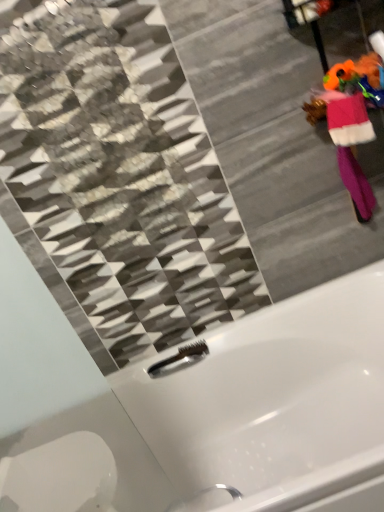
Locate an element on the screen. This screenshot has height=512, width=384. brushed metal faucet at lower center is located at coordinates pos(181,355).

What do you see at coordinates (228, 418) in the screenshot? I see `white glossy bathtub at center` at bounding box center [228, 418].

Identify the location of pink fuzzy robe at right. This screenshot has width=384, height=512. (350, 149).

Is the position of white glossy bathtub at center more distant than that of pink fuzzy robe at right?

No.

Considering the sizes of objects white glossy bathtub at center and pink fuzzy robe at right in the image provided, who is shorter, white glossy bathtub at center or pink fuzzy robe at right?

pink fuzzy robe at right is shorter.

From a real-world perspective, does white glossy bathtub at center sit lower than pink fuzzy robe at right?

Yes, from a real-world perspective, white glossy bathtub at center is beneath pink fuzzy robe at right.

Locate an element on the screen. The width and height of the screenshot is (384, 512). bathtub that is in front of the pink fuzzy robe at right is located at coordinates (228, 418).

Can you tell me how much pink fuzzy robe at right and white glossy bathtub at center differ in facing direction?

29.5 degrees separate the facing orientations of pink fuzzy robe at right and white glossy bathtub at center.

From their relative heights in the image, would you say pink fuzzy robe at right is taller or shorter than white glossy bathtub at center?

Clearly, pink fuzzy robe at right is shorter compared to white glossy bathtub at center.

Considering the positions of objects brushed metal faucet at lower center and white glossy bathtub at center in the image provided, who is more to the left, brushed metal faucet at lower center or white glossy bathtub at center?

brushed metal faucet at lower center.

Which object is wider, brushed metal faucet at lower center or white glossy bathtub at center?

white glossy bathtub at center.

You are a GUI agent. You are given a task and a screenshot of the screen. Output one action in this format:
    pyautogui.click(x=<x>, y=<y>)
    Task: Click on the bathtub located in front of the brushed metal faucet at lower center
    
    Given the screenshot: What is the action you would take?
    pyautogui.click(x=228, y=418)

Consider the image. Is brushed metal faucet at lower center looking in the opposite direction of white glossy bathtub at center?

Yes, brushed metal faucet at lower center is positioned with its back facing white glossy bathtub at center.

Is pink fuzzy robe at right turned away from brushed metal faucet at lower center?

No, pink fuzzy robe at right is not facing the opposite direction of brushed metal faucet at lower center.

Which point is more forward, (361, 178) or (154, 366)?

Point (361, 178)

Between pink fuzzy robe at right and brushed metal faucet at lower center, which one has smaller size?

Smaller between the two is brushed metal faucet at lower center.

Is pink fuzzy robe at right taller or shorter than brushed metal faucet at lower center?

Considering their sizes, pink fuzzy robe at right has more height than brushed metal faucet at lower center.

Is brushed metal faucet at lower center next to pink fuzzy robe at right?

There is a gap between brushed metal faucet at lower center and pink fuzzy robe at right.

In the scene shown: Is brushed metal faucet at lower center to the right of pink fuzzy robe at right from the viewer's perspective?

No, brushed metal faucet at lower center is not to the right of pink fuzzy robe at right.

Considering the relative sizes of brushed metal faucet at lower center and pink fuzzy robe at right in the image provided, is brushed metal faucet at lower center shorter than pink fuzzy robe at right?

Indeed, brushed metal faucet at lower center has a lesser height compared to pink fuzzy robe at right.

Considering the positions of point (201, 353) and point (361, 192), is point (201, 353) closer or farther from the camera than point (361, 192)?

Point (201, 353) appears to be farther away from the viewer than point (361, 192).

From the picture: Which of these two, white glossy bathtub at center or brushed metal faucet at lower center, is smaller?

brushed metal faucet at lower center.

I want to click on faucet located above the white glossy bathtub at center (from the image's perspective), so click(181, 355).

Who is shorter, white glossy bathtub at center or brushed metal faucet at lower center?

brushed metal faucet at lower center.

Can we say white glossy bathtub at center lies outside brushed metal faucet at lower center?

Yes, white glossy bathtub at center is not within brushed metal faucet at lower center.

Locate an element on the screen. The width and height of the screenshot is (384, 512). robe located above the white glossy bathtub at center (from the image's perspective) is located at coordinates (350, 149).

You are a GUI agent. You are given a task and a screenshot of the screen. Output one action in this format:
    pyautogui.click(x=<x>, y=<y>)
    Task: Click on the bathtub lying in front of the pink fuzzy robe at right
    The height and width of the screenshot is (512, 384).
    Given the screenshot: What is the action you would take?
    pyautogui.click(x=228, y=418)

Considering their positions, is brushed metal faucet at lower center positioned further to pink fuzzy robe at right than white glossy bathtub at center?

brushed metal faucet at lower center.

Looking at the image, which one is located closer to brushed metal faucet at lower center, white glossy bathtub at center or pink fuzzy robe at right?

white glossy bathtub at center is positioned closer to the anchor brushed metal faucet at lower center.

Considering their positions, is brushed metal faucet at lower center positioned closer to white glossy bathtub at center than pink fuzzy robe at right?

Based on the image, brushed metal faucet at lower center appears to be nearer to white glossy bathtub at center.

Estimate the real-world distances between objects in this image. Which object is closer to pink fuzzy robe at right, white glossy bathtub at center or brushed metal faucet at lower center?

white glossy bathtub at center is positioned closer to the anchor pink fuzzy robe at right.

In the scene shown: When comparing their distances from white glossy bathtub at center, does pink fuzzy robe at right or brushed metal faucet at lower center seem further?

Based on the image, pink fuzzy robe at right appears to be further to white glossy bathtub at center.

Considering their positions, is pink fuzzy robe at right positioned further to brushed metal faucet at lower center than white glossy bathtub at center?

pink fuzzy robe at right is further to brushed metal faucet at lower center.

This screenshot has height=512, width=384. I want to click on faucet between pink fuzzy robe at right and white glossy bathtub at center in the up-down direction, so click(181, 355).